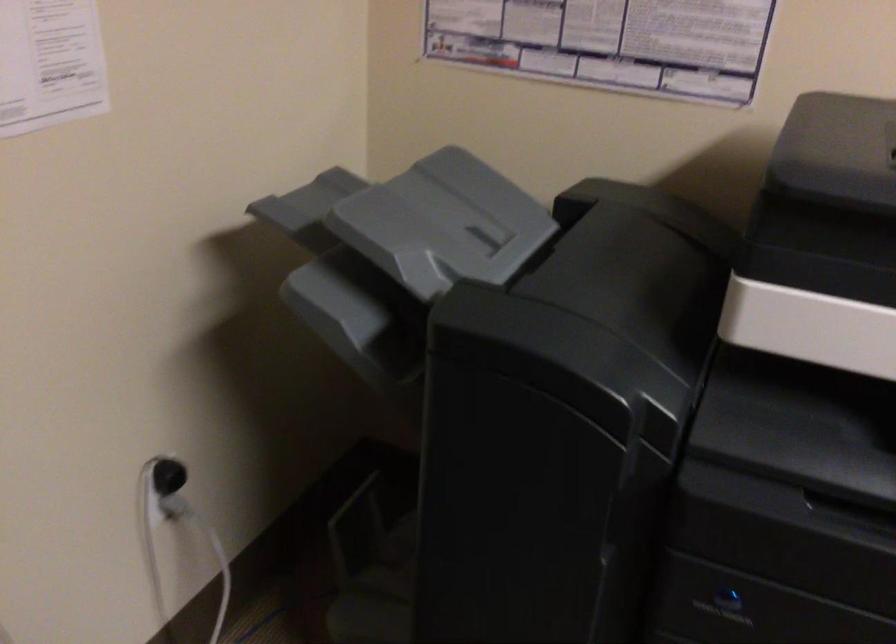
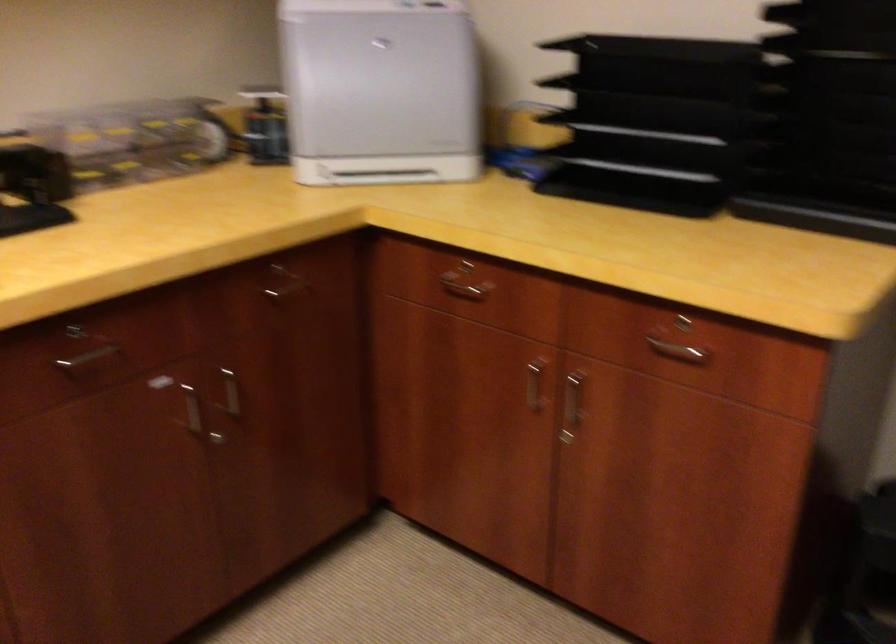
The first image is from the beginning of the video and the second image is from the end. How did the camera likely rotate when shooting the video?

The camera's rotation is toward left-down.